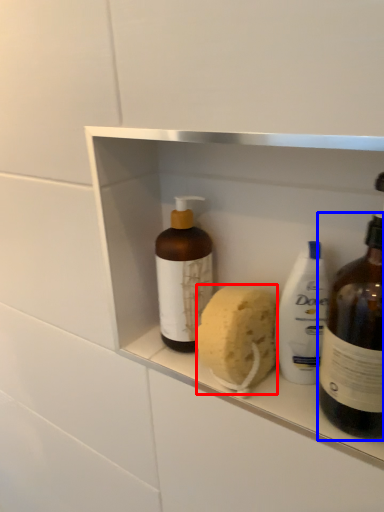
Question: Among these objects, which one is nearest to the camera, soap (highlighted by a red box) or bottle (highlighted by a blue box)?

Choices:
 (A) soap
 (B) bottle

Answer: (B)